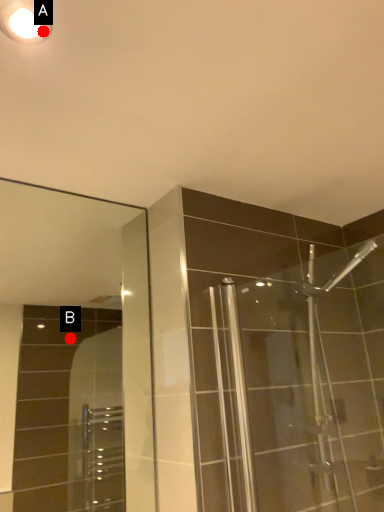
Question: Two points are circled on the image, labeled by A and B beside each circle. Which point is farther to the camera?

Choices:
 (A) A is further
 (B) B is further

Answer: (B)